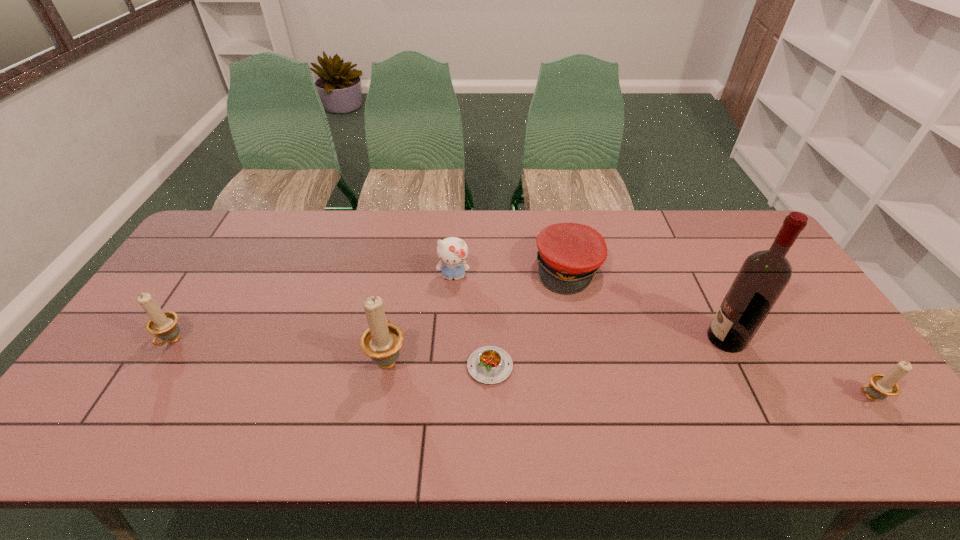
To make them evenly spaced by inserting another candle_holder among them, please locate a vacant spot for this new candle_holder. Please provide its 2D coordinates. Your answer should be formatted as a tuple, i.e. [(x, y)], where the tuple contains the x and y coordinates of a point satisfying the conditions above.

[(619, 377)]